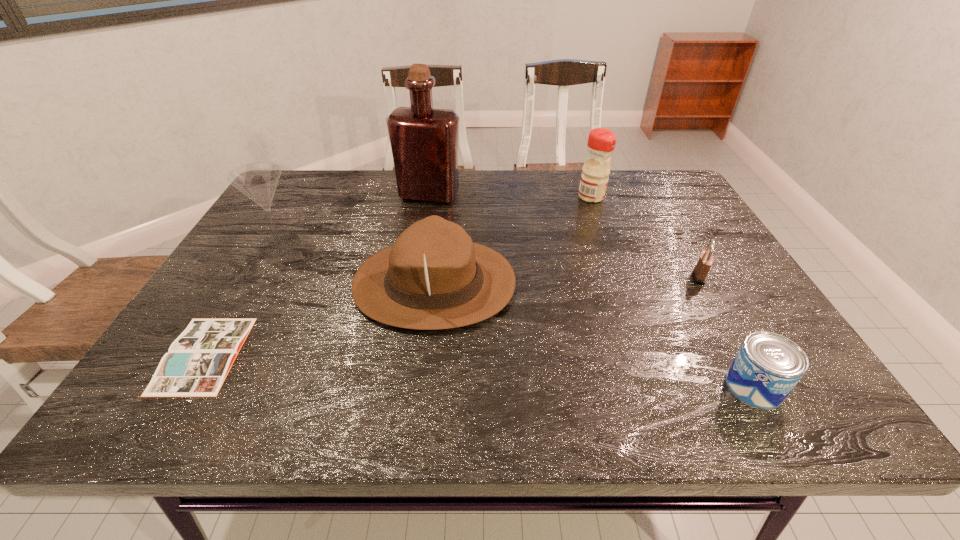
Where is `can situated at the right edge`? This screenshot has width=960, height=540. can situated at the right edge is located at coordinates (767, 367).

At what (x,y) coordinates should I click in order to perform the action: click on object at the near left corner. Please return your answer as a coordinate pair (x, y). The height and width of the screenshot is (540, 960). Looking at the image, I should click on point(199,360).

Locate an element on the screen. This screenshot has width=960, height=540. object present at the near right corner is located at coordinates (767, 367).

Locate an element on the screen. The width and height of the screenshot is (960, 540). vacant region at the far edge of the desktop is located at coordinates (480, 193).

Where is `vacant space at the near edge of the desktop`? The width and height of the screenshot is (960, 540). vacant space at the near edge of the desktop is located at coordinates (705, 402).

You are a GUI agent. You are given a task and a screenshot of the screen. Output one action in this format:
    pyautogui.click(x=<x>, y=<y>)
    Task: Click on the free spot at the left edge of the desktop
    
    Given the screenshot: What is the action you would take?
    pyautogui.click(x=306, y=212)

You are a GUI agent. You are given a task and a screenshot of the screen. Output one action in this format:
    pyautogui.click(x=<x>, y=<y>)
    Task: Click on the vacant space at the right edge
    The image size is (960, 540).
    Given the screenshot: What is the action you would take?
    pyautogui.click(x=739, y=326)

In the image, there is a desktop. At what (x,y) coordinates should I click in order to perform the action: click on blank space at the far left corner. Please return your answer as a coordinate pair (x, y). Looking at the image, I should click on (325, 189).

The height and width of the screenshot is (540, 960). What are the coordinates of `vacant space at the near left corner of the desktop` in the screenshot? It's located at (199, 401).

Find the location of a particular element. blank space at the far right corner of the desktop is located at coordinates (677, 185).